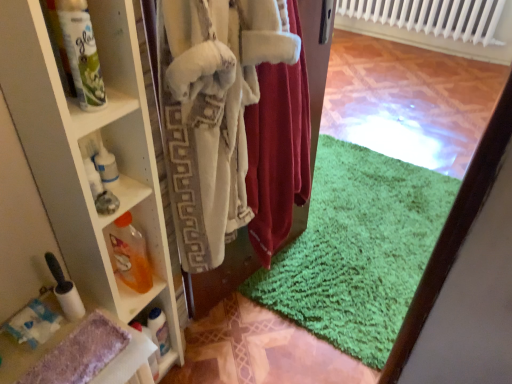
Question: Is white fuzzy robe at center, which appears as the 2th clothing when viewed from the right, to the left of velvet red robe at center, which is counted as the first clothing, starting from the right, from the viewer's perspective?

Choices:
 (A) no
 (B) yes

Answer: (B)

Question: Are white fuzzy robe at center, which appears as the 2th clothing when viewed from the right, and velvet red robe at center, which is counted as the first clothing, starting from the right, beside each other?

Choices:
 (A) yes
 (B) no

Answer: (B)

Question: Is white fuzzy robe at center, which is the 1th clothing in left-to-right order, turned away from velvet red robe at center, which is counted as the first clothing, starting from the right?

Choices:
 (A) yes
 (B) no

Answer: (B)

Question: Is white fuzzy robe at center, which is the 1th clothing in left-to-right order, further to the viewer compared to velvet red robe at center, which ranks as the 2th clothing in left-to-right order?

Choices:
 (A) yes
 (B) no

Answer: (B)

Question: Can we say white fuzzy robe at center, which is the 1th clothing in left-to-right order, lies outside velvet red robe at center, which ranks as the 2th clothing in left-to-right order?

Choices:
 (A) no
 (B) yes

Answer: (B)

Question: From a real-world perspective, is white fuzzy robe at center, which is the 1th clothing in left-to-right order, under velvet red robe at center, which is counted as the first clothing, starting from the right?

Choices:
 (A) no
 (B) yes

Answer: (B)

Question: Is velvet red robe at center, which is counted as the first clothing, starting from the right, smaller than translucent orange liquid at shelf left, the 2th bottle from the front?

Choices:
 (A) yes
 (B) no

Answer: (B)

Question: From a real-world perspective, does velvet red robe at center, which is counted as the first clothing, starting from the right, stand above translucent orange liquid at shelf left, the 2th bottle ordered from the bottom?

Choices:
 (A) no
 (B) yes

Answer: (B)

Question: Could you tell me if velvet red robe at center, which is counted as the first clothing, starting from the right, is turned towards translucent orange liquid at shelf left, the 2th bottle from the front?

Choices:
 (A) no
 (B) yes

Answer: (A)

Question: Is velvet red robe at center, which ranks as the 2th clothing in left-to-right order, next to translucent orange liquid at shelf left, the 2th bottle ordered from the bottom?

Choices:
 (A) no
 (B) yes

Answer: (A)

Question: Can you confirm if velvet red robe at center, which is counted as the first clothing, starting from the right, is bigger than translucent orange liquid at shelf left, the 2th bottle from the front?

Choices:
 (A) yes
 (B) no

Answer: (A)

Question: Does velvet red robe at center, which ranks as the 2th clothing in left-to-right order, appear on the right side of translucent orange liquid at shelf left, the 2th bottle from the front?

Choices:
 (A) yes
 (B) no

Answer: (A)

Question: Is translucent orange liquid at shelf left, placed as the 2th bottle when sorted from back to front, oriented towards white fuzzy robe at center, which is the 1th clothing in left-to-right order?

Choices:
 (A) yes
 (B) no

Answer: (A)